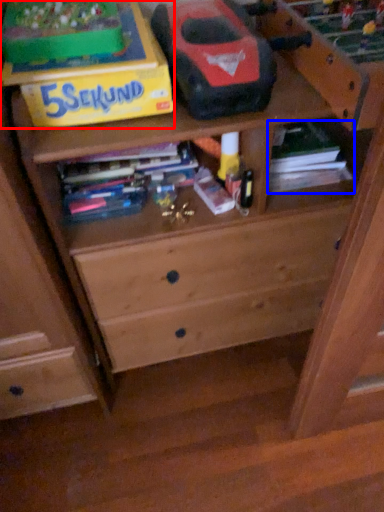
Question: Which point is closer to the camera, cardboard box (highlighted by a red box) or book (highlighted by a blue box)?

Choices:
 (A) cardboard box
 (B) book

Answer: (A)